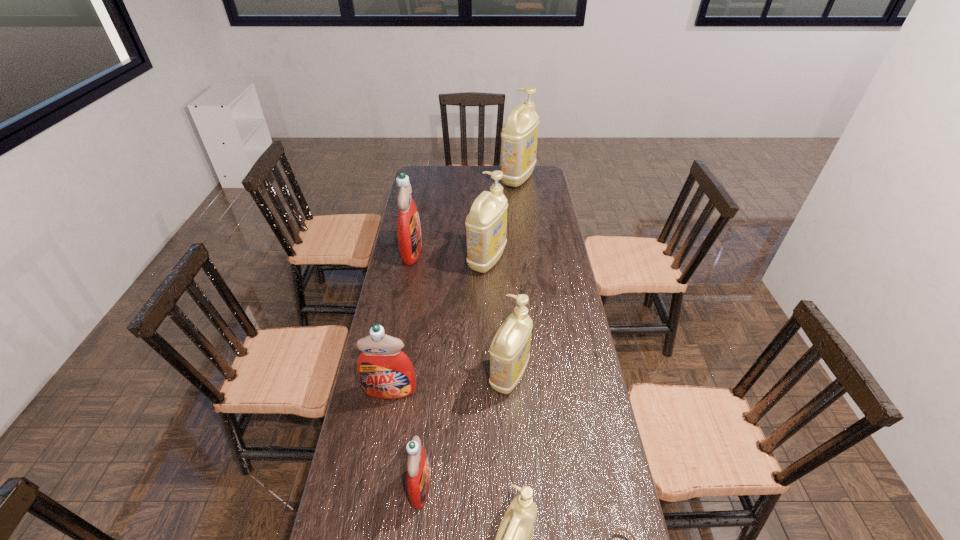
Identify the location of vacant area at the far left corner of the desktop. This screenshot has width=960, height=540. (430, 187).

Locate an element on the screen. free space at the far right corner of the desktop is located at coordinates (550, 183).

Where is `empty space that is in between the farthest red detergent and the second biggest red detergent`? Image resolution: width=960 pixels, height=540 pixels. empty space that is in between the farthest red detergent and the second biggest red detergent is located at coordinates (401, 321).

Image resolution: width=960 pixels, height=540 pixels. Identify the location of free spot between the second smallest beige detergent and the rightmost red detergent. (465, 431).

The height and width of the screenshot is (540, 960). Find the location of `unoccupied position between the second smallest red detergent and the farthest detergent`. unoccupied position between the second smallest red detergent and the farthest detergent is located at coordinates (454, 285).

Identify the location of free space between the second smallest beige detergent and the third nearest beige detergent. The height and width of the screenshot is (540, 960). (498, 318).

Where is `free area in between the farthest detergent and the second nearest red detergent`? free area in between the farthest detergent and the second nearest red detergent is located at coordinates (454, 285).

The width and height of the screenshot is (960, 540). What are the coordinates of `vacant region between the biggest red detergent and the farthest beige detergent` in the screenshot? It's located at (465, 215).

Image resolution: width=960 pixels, height=540 pixels. In order to click on object that is the fourth closest one to the smallest beige detergent in this screenshot , I will do `click(385, 372)`.

Identify the location of object identified as the closest to the second farthest beige detergent. The width and height of the screenshot is (960, 540). (409, 236).